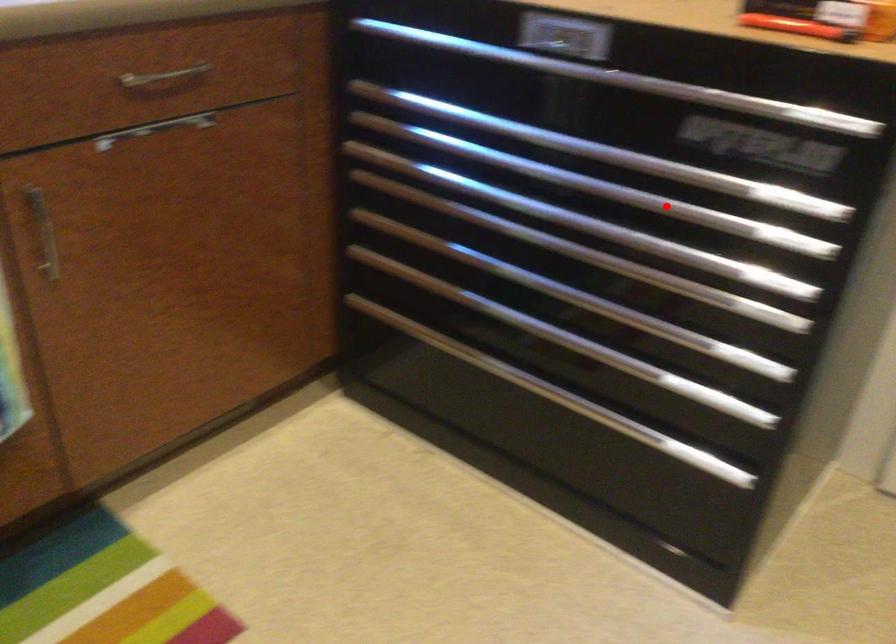
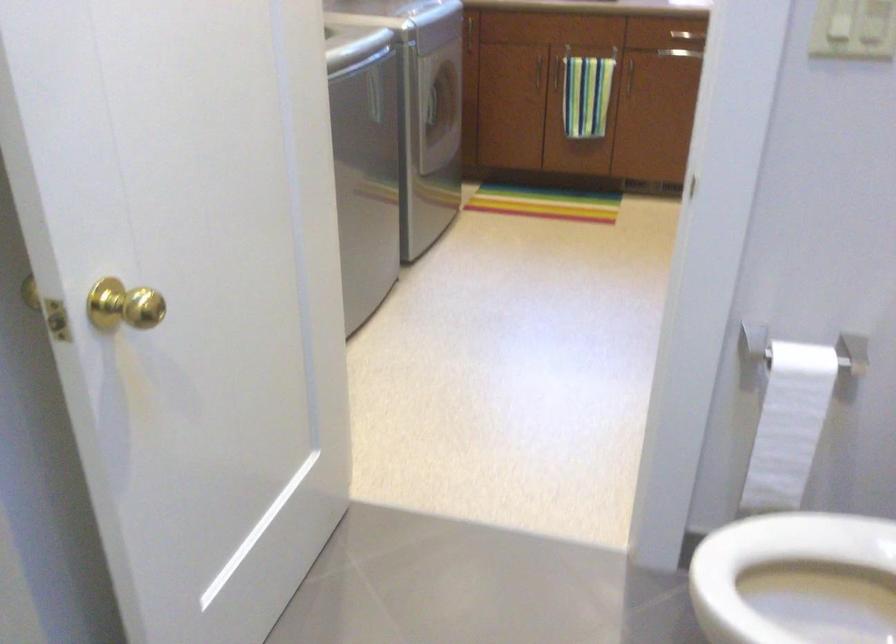
Question: I am providing you with two images of the same scene from different viewpoints. A red point is marked on the first image. At the location where the point appears in image 1, is it still visible in image 2?

Choices:
 (A) Yes
 (B) No

Answer: (B)